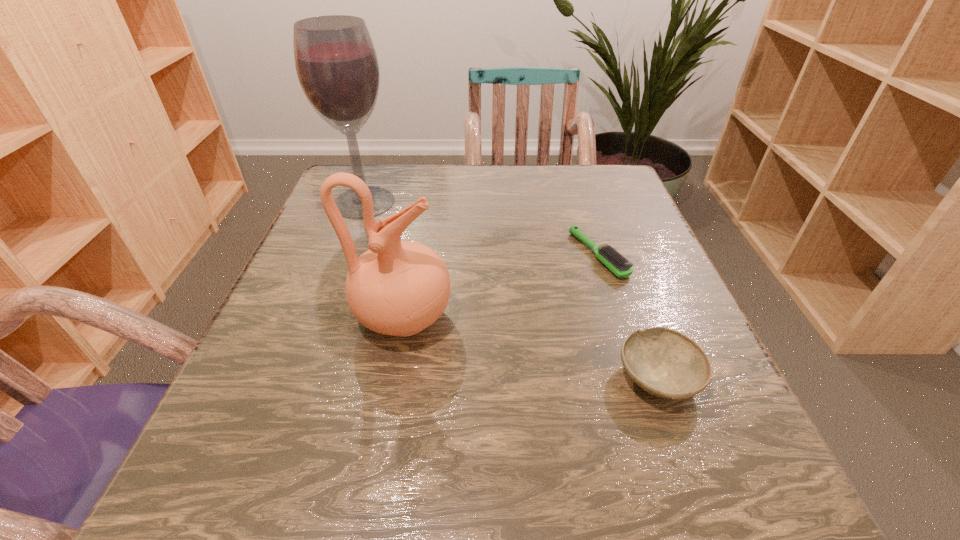
Locate an element on the screen. object present at the far edge is located at coordinates (336, 63).

Locate an element on the screen. The image size is (960, 540). alcohol situated at the left edge is located at coordinates (336, 63).

The height and width of the screenshot is (540, 960). I want to click on pottery that is at the left edge, so click(399, 288).

You are a GUI agent. You are given a task and a screenshot of the screen. Output one action in this format:
    pyautogui.click(x=<x>, y=<y>)
    Task: Click on the bowl that is at the right edge
    This screenshot has height=540, width=960.
    Given the screenshot: What is the action you would take?
    pyautogui.click(x=664, y=362)

The image size is (960, 540). I want to click on hairbrush that is at the right edge, so click(608, 256).

This screenshot has width=960, height=540. In order to click on object that is at the far left corner in this screenshot , I will do `click(336, 63)`.

Where is `free space at the far edge of the desktop`? The image size is (960, 540). free space at the far edge of the desktop is located at coordinates (441, 164).

Image resolution: width=960 pixels, height=540 pixels. What are the coordinates of `vacant space at the near edge of the desktop` in the screenshot? It's located at (388, 459).

I want to click on vacant space at the left edge of the desktop, so click(x=279, y=291).

Locate an element on the screen. The width and height of the screenshot is (960, 540). vacant space at the right edge of the desktop is located at coordinates (620, 306).